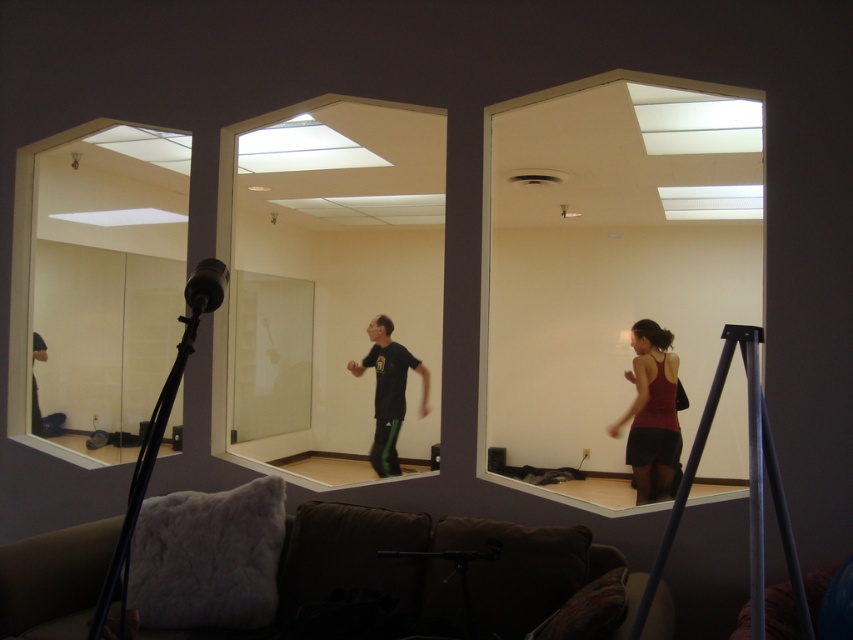
Who is shorter, matte white mirror at center or matte red tank top at center?

matte red tank top at center is shorter.

At what (x,y) coordinates should I click in order to perform the action: click on matte white mirror at center. Please return your answer as a coordinate pair (x, y). The height and width of the screenshot is (640, 853). Looking at the image, I should click on (x=614, y=268).

Who is more distant from viewer, (695, 289) or (651, 412)?

The point (695, 289) is behind.

The image size is (853, 640). Identify the location of matte white mirror at center. (614, 268).

Is metallic tripod at right taller than matte red tank top at center?

No, metallic tripod at right is not taller than matte red tank top at center.

Which of these two, metallic tripod at right or matte red tank top at center, stands shorter?

Standing shorter between the two is metallic tripod at right.

Image resolution: width=853 pixels, height=640 pixels. What do you see at coordinates (747, 486) in the screenshot? I see `metallic tripod at right` at bounding box center [747, 486].

In order to click on metallic tripod at right in this screenshot , I will do `click(747, 486)`.

Between point (350, 477) and point (631, 442), which one is positioned in front?

Point (631, 442) is in front.

Is clear glass mirror at center below matte red tank top at center?

Incorrect, clear glass mirror at center is not positioned below matte red tank top at center.

Does point (321, 408) come closer to viewer compared to point (674, 413)?

No, (321, 408) is further to viewer.

Image resolution: width=853 pixels, height=640 pixels. I want to click on clear glass mirror at center, so click(x=329, y=284).